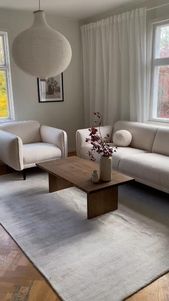
Locate an element on the screen. Image resolution: width=169 pixels, height=301 pixels. back far left sofa cushion is located at coordinates (144, 136).